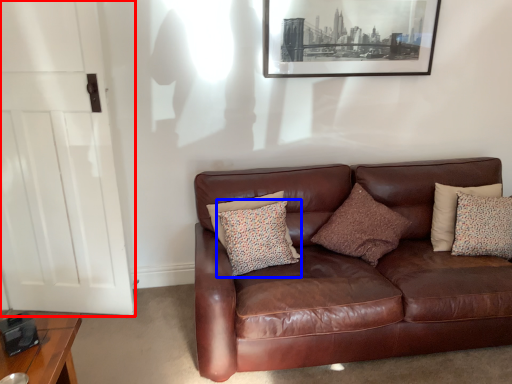
Question: Which object is closer to the camera taking this photo, door (highlighted by a red box) or pillow (highlighted by a blue box)?

Choices:
 (A) door
 (B) pillow

Answer: (A)